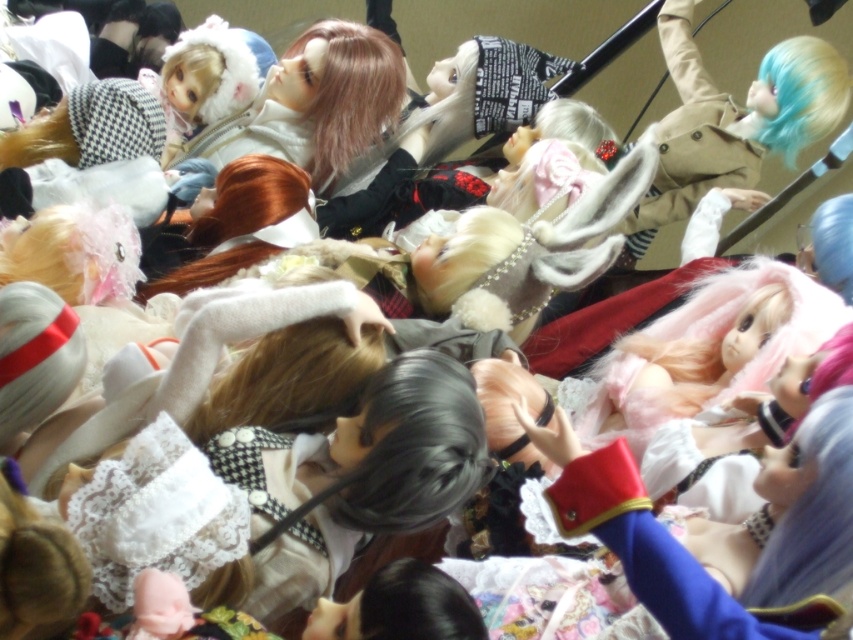
Who is shorter, light brown silky hair at center or blue silky hair at upper right?

Standing shorter between the two is blue silky hair at upper right.

Is the position of light brown silky hair at center more distant than that of blue silky hair at upper right?

Yes.

The height and width of the screenshot is (640, 853). What do you see at coordinates (350, 93) in the screenshot? I see `light brown silky hair at center` at bounding box center [350, 93].

In order to click on light brown silky hair at center in this screenshot , I will do `click(350, 93)`.

Which is in front, point (819, 205) or point (558, 112)?

Point (558, 112) is more forward.

At what (x,y) coordinates should I click in order to perform the action: click on blue silky hair at upper right. Please return your answer as a coordinate pair (x, y). This screenshot has height=640, width=853. Looking at the image, I should click on (833, 244).

Does point (585, 124) come in front of point (190, 90)?

That is True.

Who is more distant from viewer, (547, 120) or (207, 48)?

The point (207, 48) is more distant.

Locate an element on the screen. white silky hair at center is located at coordinates (572, 124).